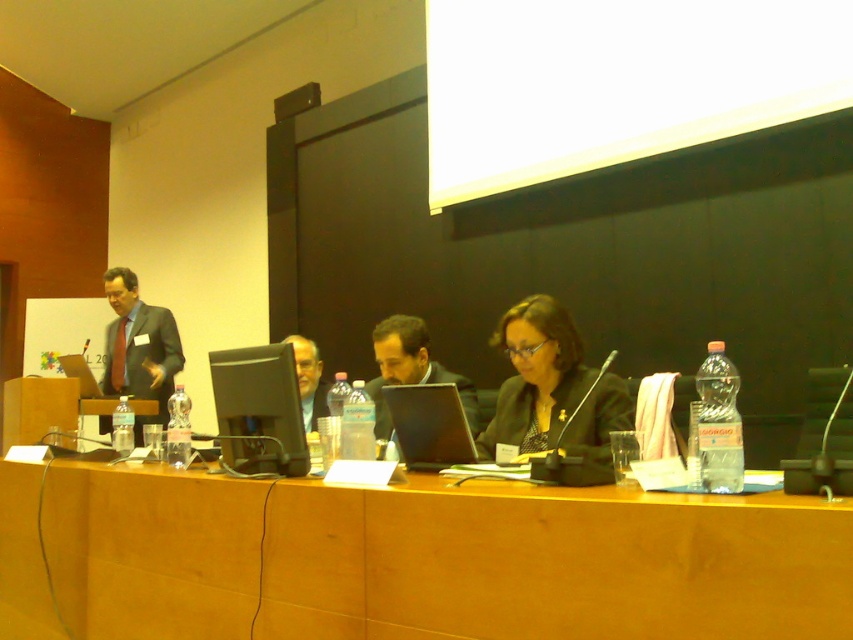
Question: Which object is positioned closest to the matte black jacket at center?

Choices:
 (A) matte black suit at left
 (B) matte black laptop at center

Answer: (B)

Question: Does matte black laptop at center have a smaller size compared to matte black laptop at left?

Choices:
 (A) no
 (B) yes

Answer: (A)

Question: Can you confirm if black plastic laptop at center is thinner than matte black laptop at left?

Choices:
 (A) yes
 (B) no

Answer: (A)

Question: Which of these objects is positioned closest to the matte black jacket at center?

Choices:
 (A) matte black laptop at left
 (B) black plastic laptop at center
 (C) matte black laptop at center
 (D) wooden table at center

Answer: (B)

Question: Which object appears closest to the camera in this image?

Choices:
 (A) matte black suit at left
 (B) wooden table at center
 (C) matte black laptop at center

Answer: (B)

Question: Is matte black jacket at center thinner than matte black suit at left?

Choices:
 (A) yes
 (B) no

Answer: (A)